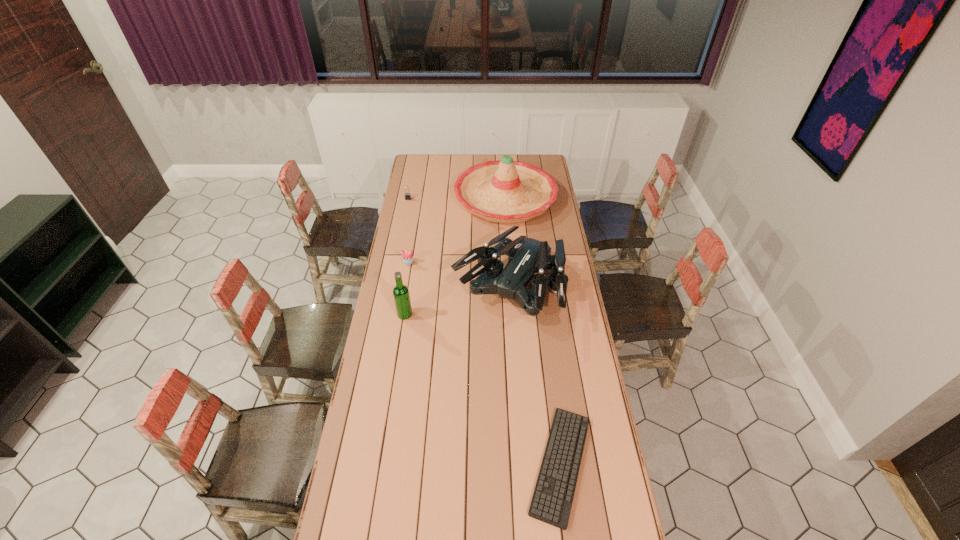
The width and height of the screenshot is (960, 540). Identify the location of vacant region located on the shackle of the padlock. (402, 232).

Where is `blank area located on the face of the cupcake`? blank area located on the face of the cupcake is located at coordinates (406, 274).

The width and height of the screenshot is (960, 540). In order to click on free space located on the left of the computer keyboard in this screenshot , I will do `click(409, 464)`.

This screenshot has width=960, height=540. Find the location of `object that is at the far edge`. object that is at the far edge is located at coordinates tap(505, 191).

I want to click on beer bottle that is at the left edge, so click(401, 295).

The image size is (960, 540). I want to click on padlock located at the left edge, so click(x=407, y=195).

This screenshot has width=960, height=540. In order to click on cupcake positioned at the left edge in this screenshot , I will do `click(407, 256)`.

Locate an element on the screen. sombrero that is at the right edge is located at coordinates (505, 191).

The height and width of the screenshot is (540, 960). In order to click on drone at the right edge in this screenshot , I will do `click(526, 256)`.

Identify the location of computer keyboard at the right edge. This screenshot has height=540, width=960. (551, 503).